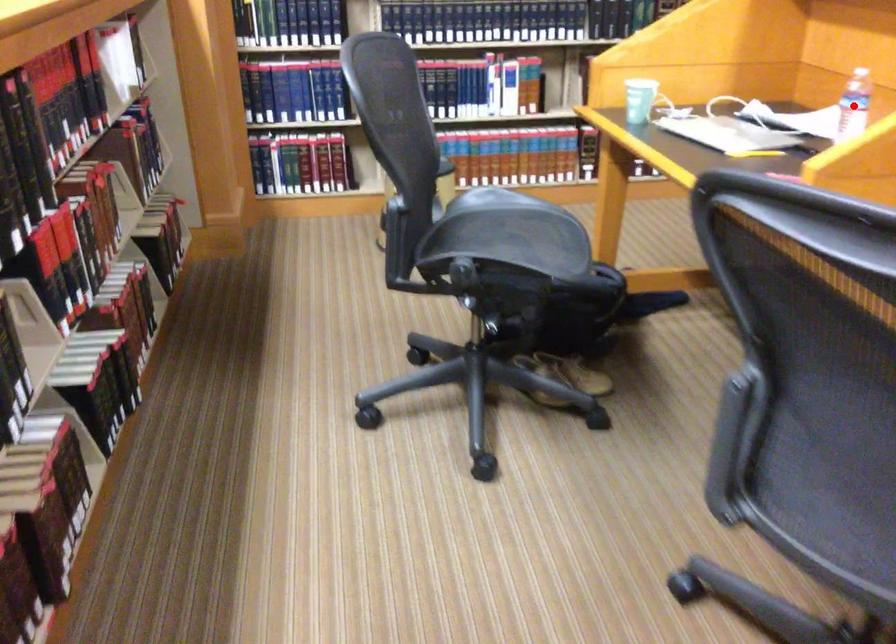
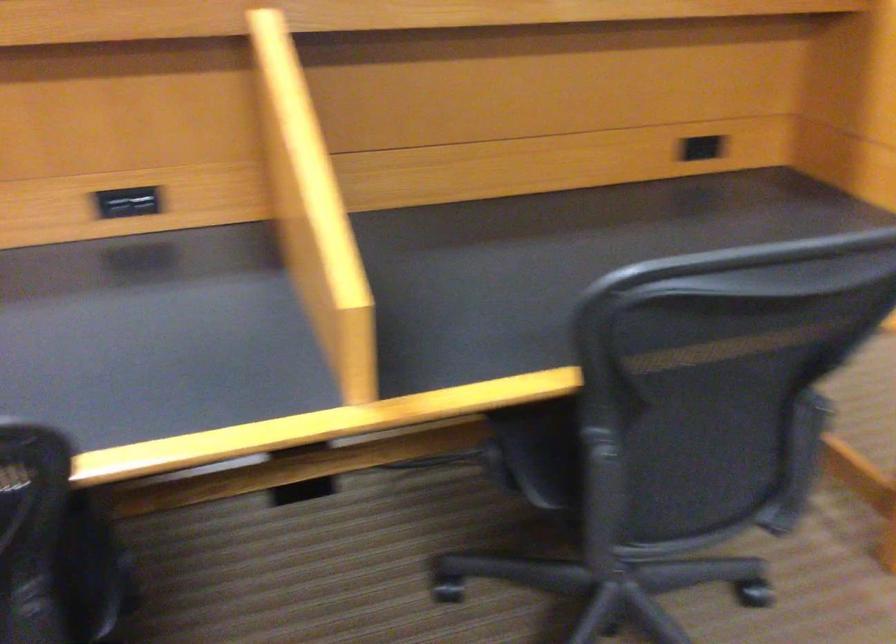
Question: I am providing you with two images of the same scene from different viewpoints. A red point is marked on the first image. Can you still see the location of the red point in image 2?

Choices:
 (A) Yes
 (B) No

Answer: (B)